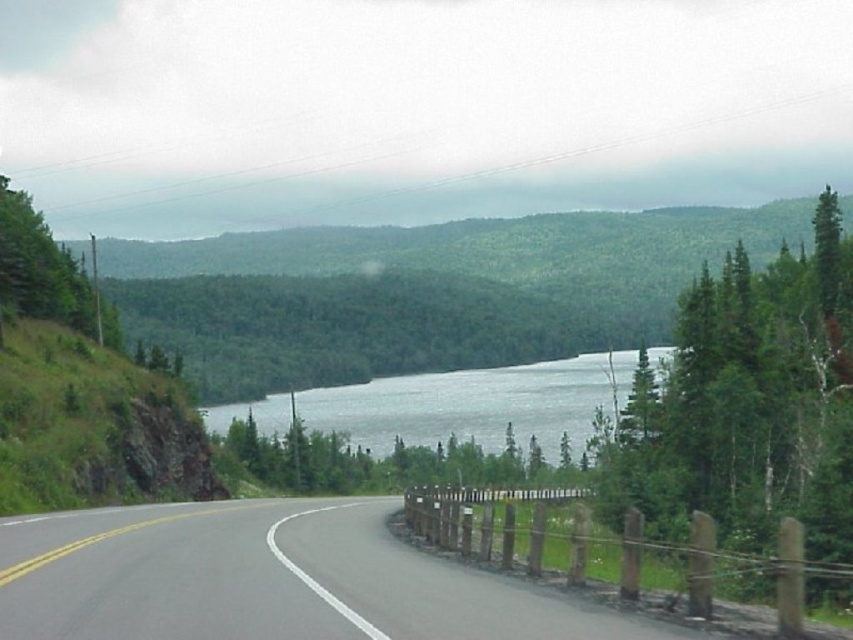
Who is more distant from viewer, (378, 531) or (544, 422)?

Point (544, 422)

Identify the location of gray asphalt highway at center. The width and height of the screenshot is (853, 640). (270, 579).

Which is in front, point (213, 528) or point (756, 497)?

Point (213, 528) is in front.

Who is more forward, (x=630, y=620) or (x=602, y=470)?

Positioned in front is point (x=630, y=620).

Image resolution: width=853 pixels, height=640 pixels. I want to click on gray asphalt highway at center, so click(x=270, y=579).

This screenshot has width=853, height=640. What do you see at coordinates (747, 404) in the screenshot?
I see `green leafy tree at upper right` at bounding box center [747, 404].

Who is more forward, (778, 259) or (560, 406)?

Point (778, 259) is in front.

The height and width of the screenshot is (640, 853). Find the location of `green leafy tree at upper right`. green leafy tree at upper right is located at coordinates (747, 404).